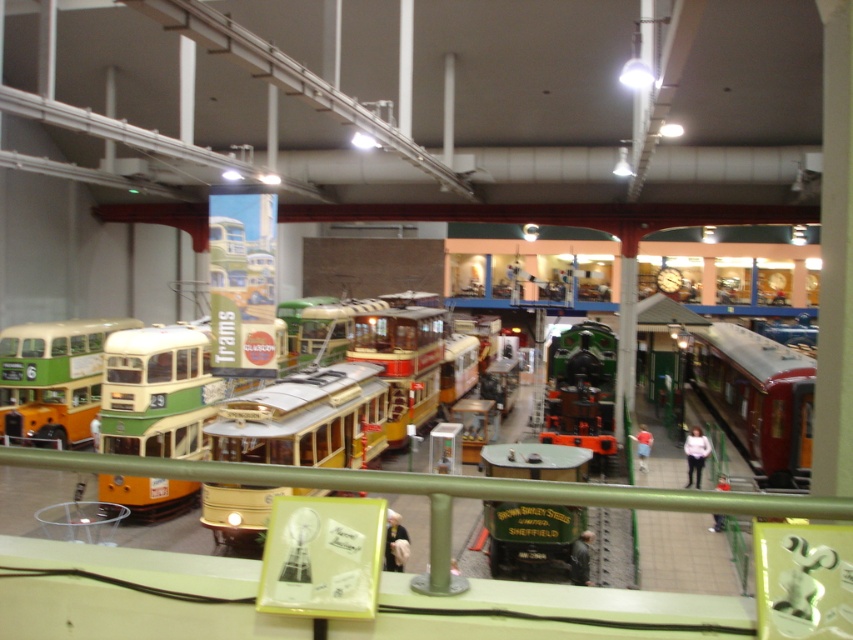
Question: In this image, where is gold metallic tram at center located relative to green matte double-decker bus at left?

Choices:
 (A) left
 (B) right

Answer: (B)

Question: Does gold metallic tram at center have a smaller size compared to green matte double-decker bus at left?

Choices:
 (A) yes
 (B) no

Answer: (B)

Question: Which object appears closest to the camera in this image?

Choices:
 (A) gold metallic tram at center
 (B) green matte double-decker bus at left

Answer: (A)

Question: Which object is closer to the camera taking this photo?

Choices:
 (A) gold metallic tram at center
 (B) green matte double-decker bus at left

Answer: (A)

Question: Is gold metallic tram at center in front of green matte double-decker bus at left?

Choices:
 (A) yes
 (B) no

Answer: (A)

Question: Among these points, which one is nearest to the camera?

Choices:
 (A) (67, 404)
 (B) (299, 392)

Answer: (B)